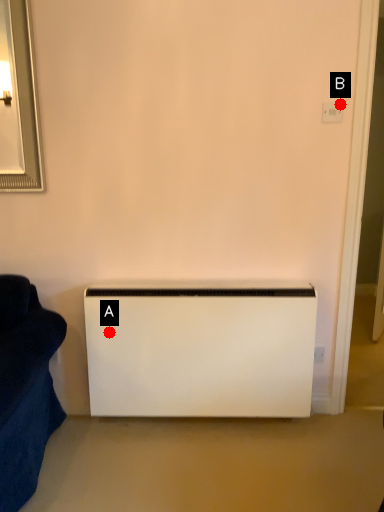
Question: Two points are circled on the image, labeled by A and B beside each circle. Which point is further to the camera?

Choices:
 (A) A is further
 (B) B is further

Answer: (A)